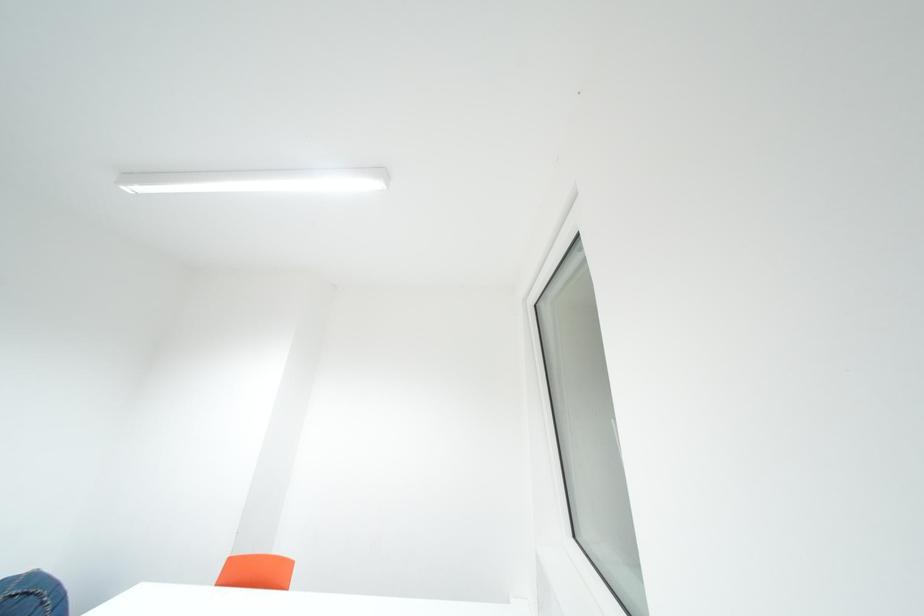
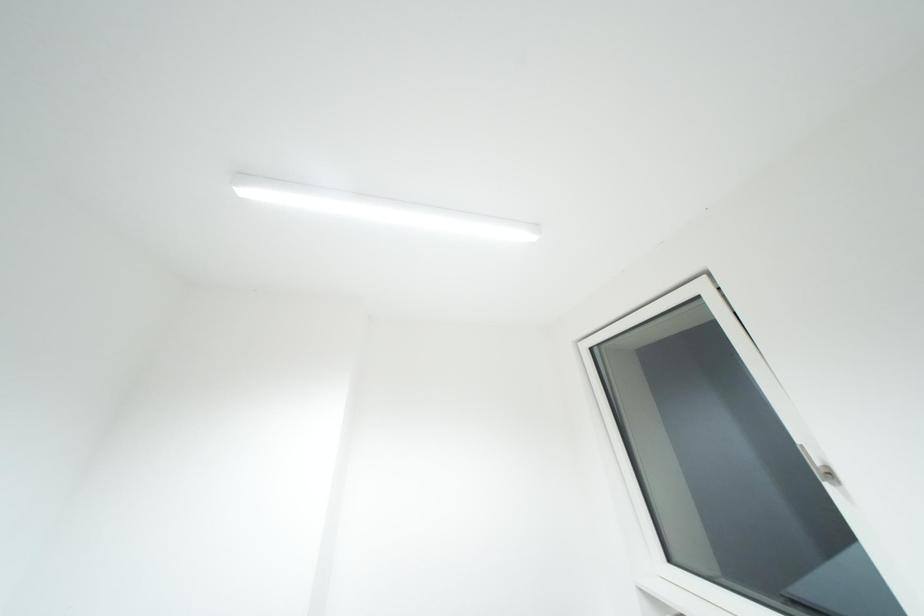
Question: In a continuous first-person perspective shot, in which direction is the camera moving?

Choices:
 (A) Left
 (B) Right
 (C) Forward
 (D) Backward

Answer: (A)